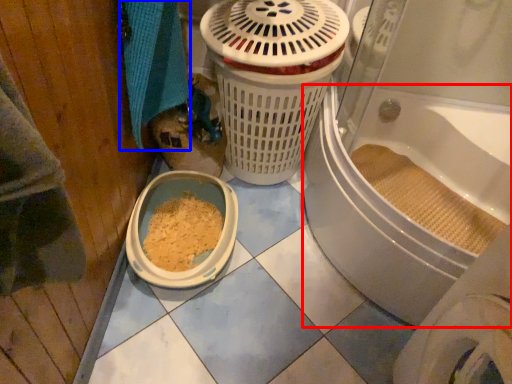
Question: Which point is closer to the camera, bath (highlighted by a red box) or bath towel (highlighted by a blue box)?

Choices:
 (A) bath
 (B) bath towel

Answer: (A)